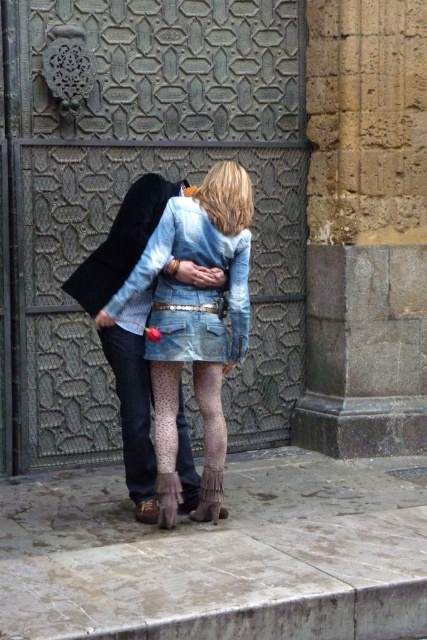
How much distance is there between denim jacket at center and denim skirt at lower center?

The distance of denim jacket at center from denim skirt at lower center is 12.04 inches.

Is denim jacket at center to the right of denim skirt at lower center from the viewer's perspective?

Indeed, denim jacket at center is positioned on the right side of denim skirt at lower center.

Where is `denim jacket at center`? denim jacket at center is located at coordinates click(193, 314).

Locate an element on the screen. This screenshot has width=427, height=640. denim jacket at center is located at coordinates (193, 314).

Who is more forward, (129, 278) or (111, 336)?

Point (129, 278) is more forward.

Does faded denim jacket at lower right appear on the right side of denim skirt at lower center?

Correct, you'll find faded denim jacket at lower right to the right of denim skirt at lower center.

The image size is (427, 640). I want to click on faded denim jacket at lower right, so [x=192, y=288].

Is denim jacket at center to the right of faded denim jacket at lower right from the viewer's perspective?

Incorrect, denim jacket at center is not on the right side of faded denim jacket at lower right.

Who is lower down, denim jacket at center or faded denim jacket at lower right?

denim jacket at center

Locate an element on the screen. This screenshot has height=640, width=427. denim jacket at center is located at coordinates (193, 314).

Identify the location of denim jacket at center. The height and width of the screenshot is (640, 427). (193, 314).